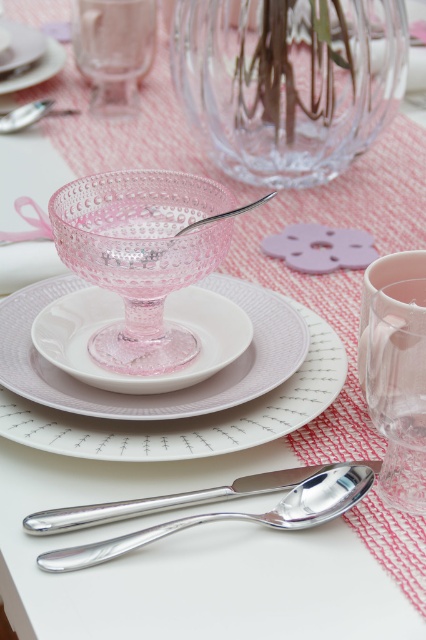
Question: Is pink textured glass at center to the left of polished silver spoon at center from the viewer's perspective?

Choices:
 (A) yes
 (B) no

Answer: (A)

Question: Is silver metallic spoon at upper left smaller than silver metallic spoon at center?

Choices:
 (A) no
 (B) yes

Answer: (B)

Question: Which point is closer to the camera?

Choices:
 (A) transparent glass saucer at center
 (B) silver metallic spoon at upper left
 (C) transparent glass vase at upper center
 (D) white matte plate at upper left

Answer: (A)

Question: Which point is closer to the camera?

Choices:
 (A) (11, 116)
 (B) (195, 499)
 (C) (262, 202)
 (D) (34, 340)

Answer: (B)

Question: Is matte white plate at center thinner than silver metallic spoon at upper left?

Choices:
 (A) no
 (B) yes

Answer: (A)

Question: Which point is farther to the camera?

Choices:
 (A) transparent glass vase at upper center
 (B) pink textured glass at center

Answer: (A)